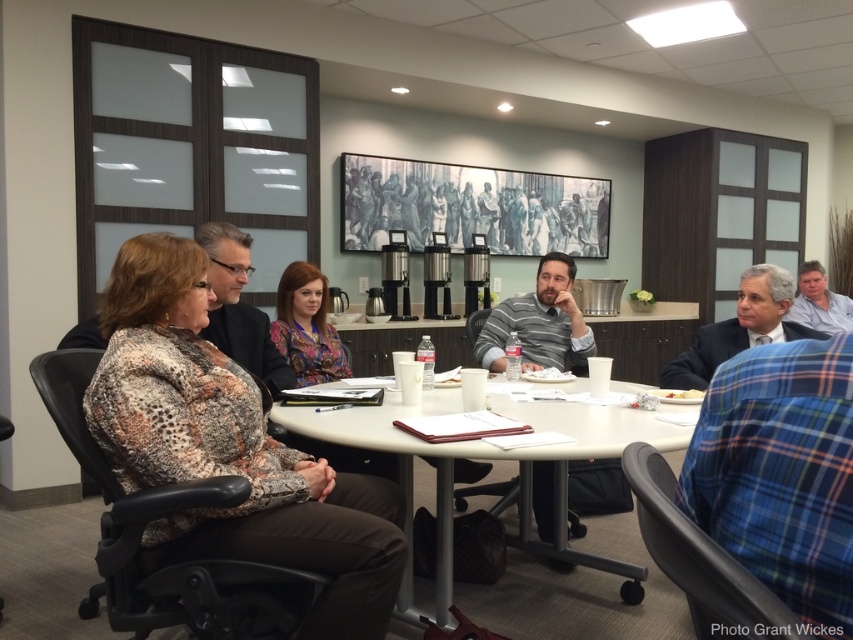
You are a photographer taking a picture of the meeting room scene. You need to focus on the printed fabric blouse at left and the white plastic table at center. Which object should you adjust your camera focus on first if you want to capture both clearly?

The printed fabric blouse at left is located above the white plastic table at center, so you should focus on the white plastic table at center first since it is closer to the camera. This way, the blouse will also be in focus due to its position above the table.

You are an office assistant who needs to deliver a document to the printed fabric blouse at left and the white plastic table at center. Which object is closer to the entrance of the room?

The printed fabric blouse at left is closer to the entrance because it is positioned to the left of the white plastic table at center, which is further away from the entrance.

In the professional meeting room scene, there is a white plastic table at center and a dark gray suit at right. Which object occupies more space in the image?

The white plastic table at center is larger in size than the dark gray suit at right, so it occupies more space in the image.